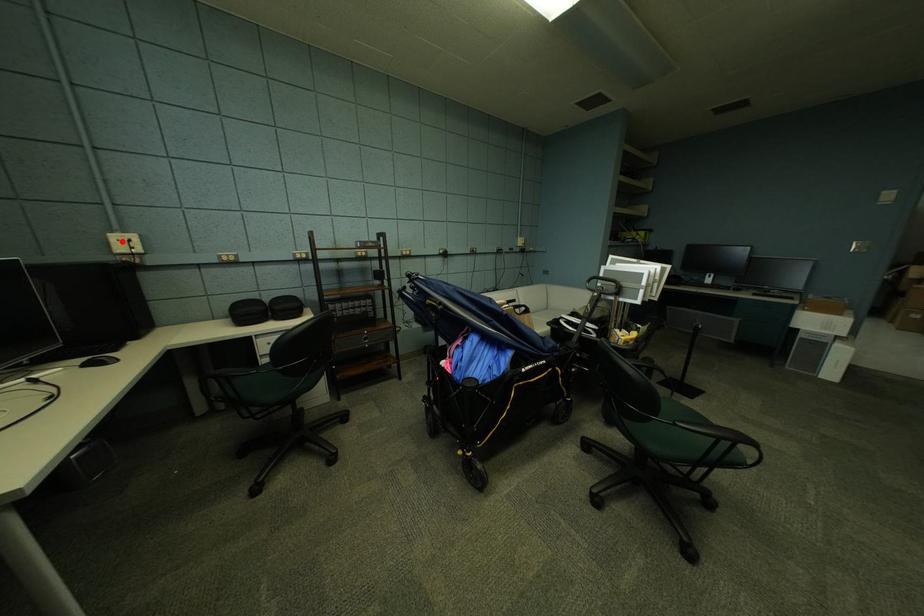
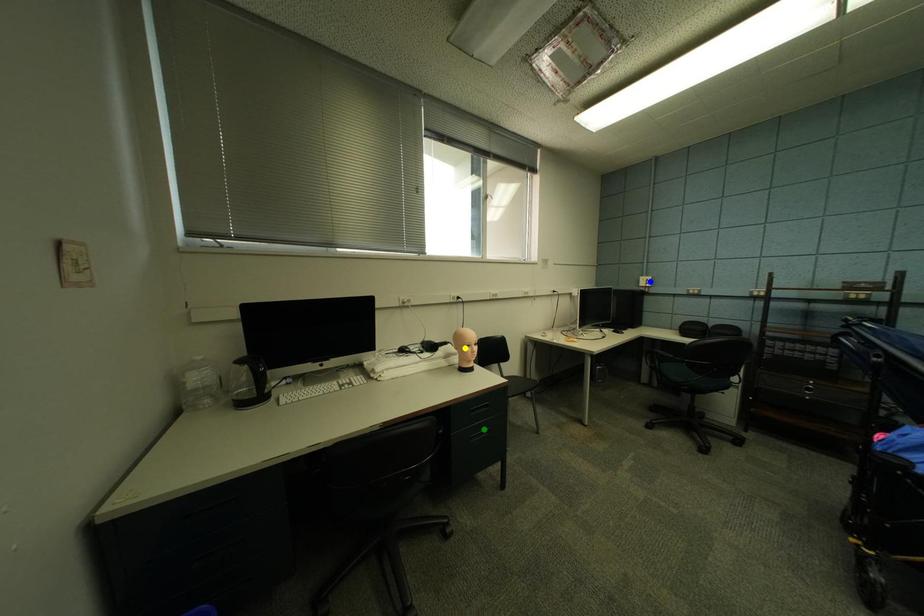
Question: I am providing you with two images of the same scene from different viewpoints. A red point is marked on the first image. You are given multiple points on the second image. Which point in image 2 is actually the same real-world point as the red point in image 1?

Choices:
 (A) blue point
 (B) green point
 (C) yellow point

Answer: (A)